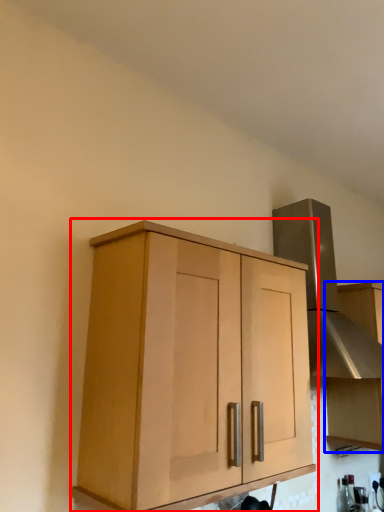
Question: Among these objects, which one is farthest to the camera, cabinetry (highlighted by a red box) or cabinetry (highlighted by a blue box)?

Choices:
 (A) cabinetry
 (B) cabinetry

Answer: (B)